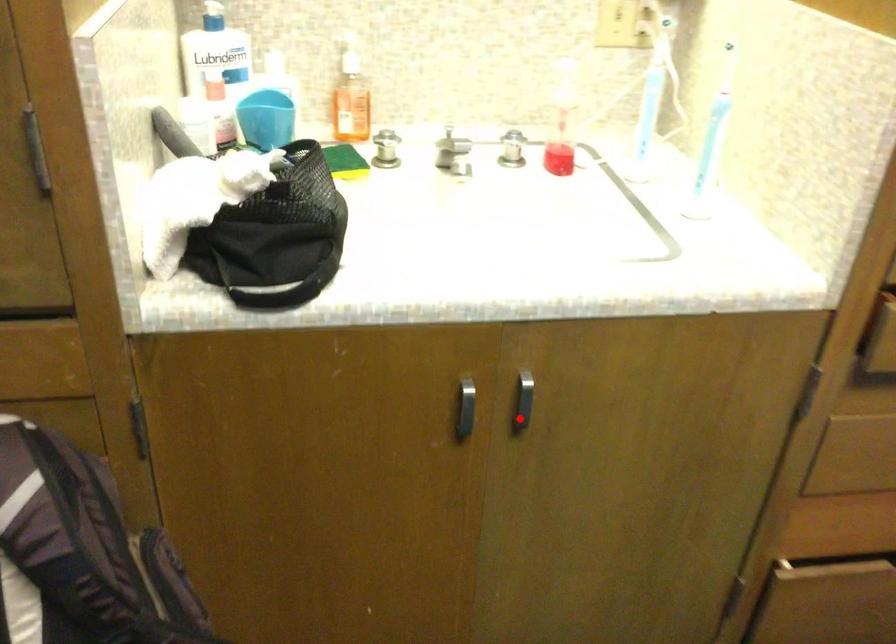
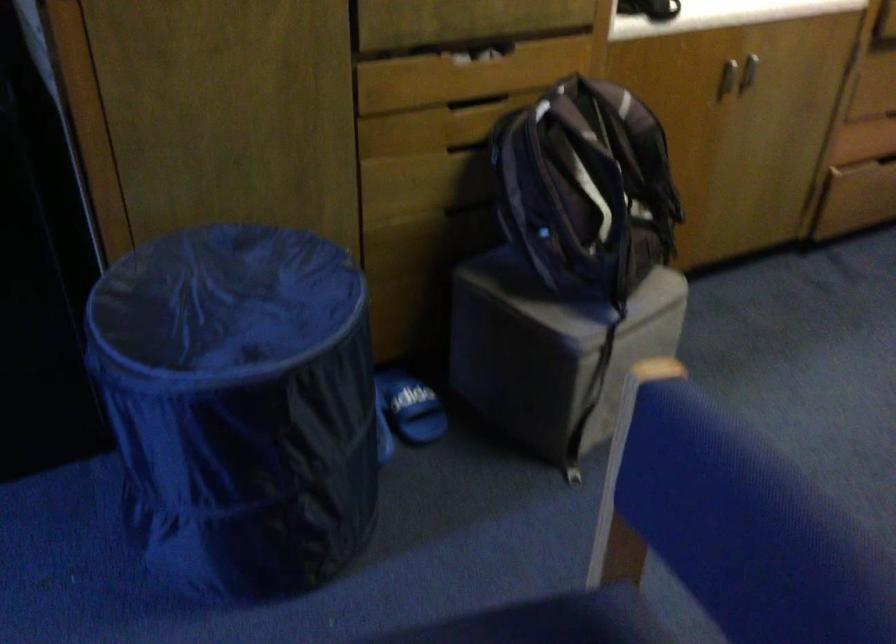
The point at the highlighted location is marked in the first image. Where is the corresponding point in the second image?

(748, 71)